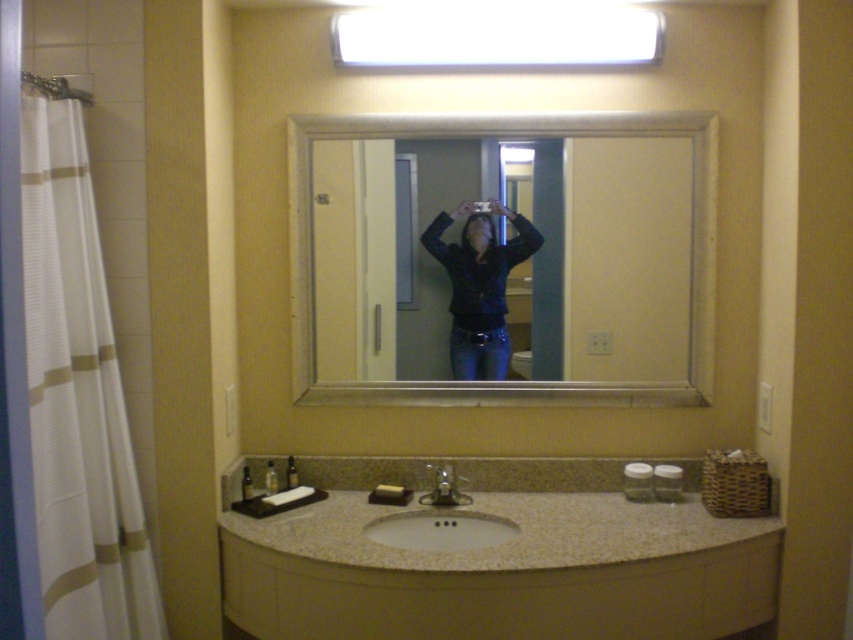
Is white textured fabric at left closer to camera compared to silver metallic mirror at center?

That is True.

I want to click on white textured fabric at left, so click(77, 397).

In order to click on white textured fabric at left in this screenshot , I will do `click(77, 397)`.

I want to click on shiny black jacket at center, so click(x=479, y=285).

Is shiny black jacket at center taller than silver metallic faucet at center?

Yes, shiny black jacket at center is taller than silver metallic faucet at center.

You are a GUI agent. You are given a task and a screenshot of the screen. Output one action in this format:
    pyautogui.click(x=<x>, y=<y>)
    Task: Click on the shiny black jacket at center
    
    Given the screenshot: What is the action you would take?
    pyautogui.click(x=479, y=285)

Locate an element on the screen. Image resolution: width=853 pixels, height=640 pixels. shiny black jacket at center is located at coordinates (479, 285).

Can you confirm if white glossy sink at center is positioned above silver metallic faucet at center?

No, white glossy sink at center is not above silver metallic faucet at center.

Is point (374, 525) more distant than point (444, 486)?

No, it is not.

Is point (434, 467) positioned before point (437, 497)?

That is False.

In order to click on white glossy sink at center in this screenshot , I will do `click(440, 518)`.